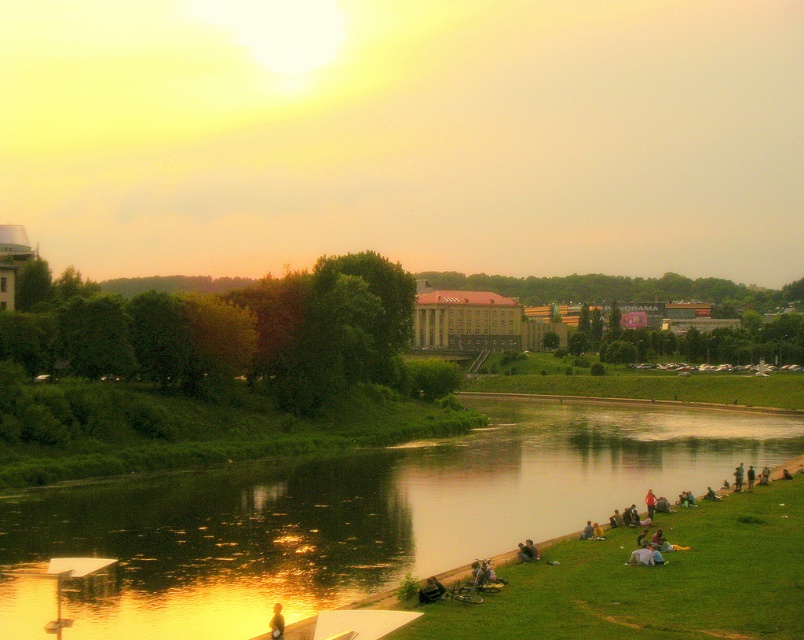
You are standing at the point marked as point [370,512] in the image. What do you see directly in front of you?

You see green reflective water at center directly in front of you at point [370,512].

In the scene shown: You are standing at the edge of the river and want to locate the green reflective water at center. According to the coordinates provided, in which direction should you look relative to your current position?

The green reflective water at center is located at coordinates point (370, 512). Since the x coordinate is 0.800, which is to the right of the center point, and the y coordinate is 0.461, which is slightly above the center point, you should look towards the upper right direction from your current position to locate it.